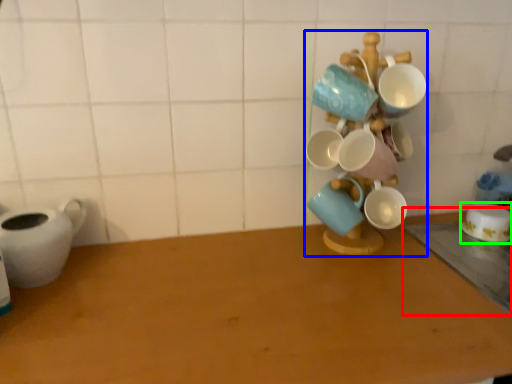
Question: Which object is positioned closest to table (highlighted by a red box)? Select from collection (highlighted by a blue box) and coffee cup (highlighted by a green box).

Choices:
 (A) collection
 (B) coffee cup

Answer: (B)